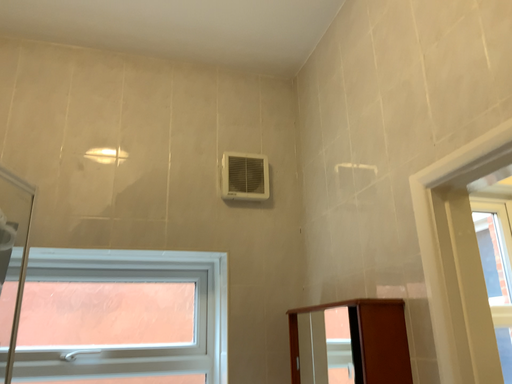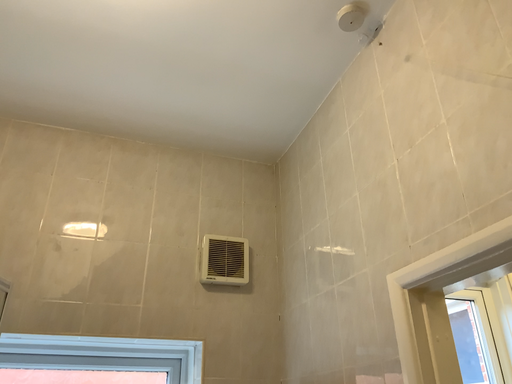
Question: Which way did the camera rotate in the video?

Choices:
 (A) rotated downward
 (B) rotated upward

Answer: (B)